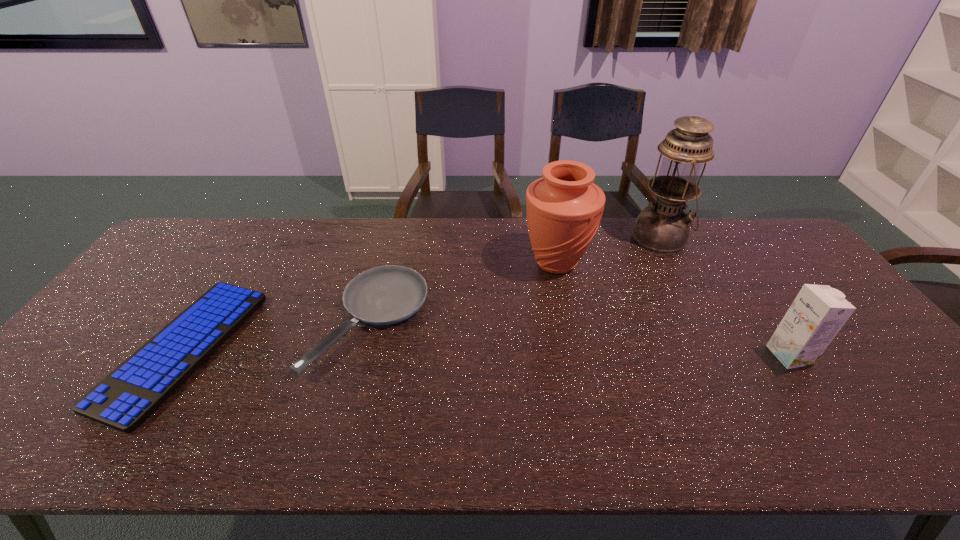
Identify the location of free space at the far edge of the desktop. (357, 229).

I want to click on blank space at the near edge of the desktop, so click(680, 434).

Locate an element on the screen. This screenshot has width=960, height=540. free space at the left edge of the desktop is located at coordinates (184, 287).

This screenshot has height=540, width=960. In the image, there is a desktop. What are the coordinates of `vacant area at the right edge` in the screenshot? It's located at (802, 268).

Locate an element on the screen. This screenshot has width=960, height=540. vacant point located between the frying pan and the carton is located at coordinates (580, 338).

Where is `free spot between the second object from left to right and the second tallest object`? The image size is (960, 540). free spot between the second object from left to right and the second tallest object is located at coordinates (463, 291).

Where is `vacant region between the third tallest object and the leftmost object`? Image resolution: width=960 pixels, height=540 pixels. vacant region between the third tallest object and the leftmost object is located at coordinates (487, 352).

Find the location of `free space between the second object from left to right and the oil lamp`. free space between the second object from left to right and the oil lamp is located at coordinates (516, 279).

The height and width of the screenshot is (540, 960). I want to click on free spot between the leftmost object and the fourth object from right to left, so click(276, 335).

Find the location of a particular element. free space between the second shortest object and the third tallest object is located at coordinates [580, 338].